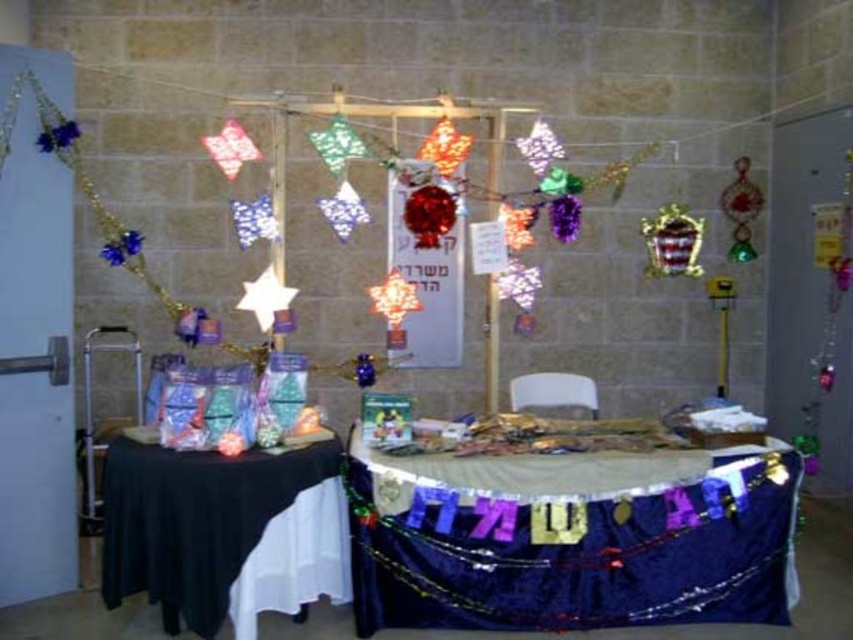
You are a guest at the event and want to find the shiny blue tablecloth at center. From your position, which direction should you look relative to the black fabric table at lower left?

The shiny blue tablecloth at center is to the right of the black fabric table at lower left, so you should look to the right of the black fabric table at lower left to find it.

You are standing in the festive indoor setting and want to place a decoration between the two points marked as point (x=461, y=602) and point (x=177, y=602). Which point is closer to you so that you can reach it first?

Point (x=177, y=602) is closer to you, so you can reach it first.